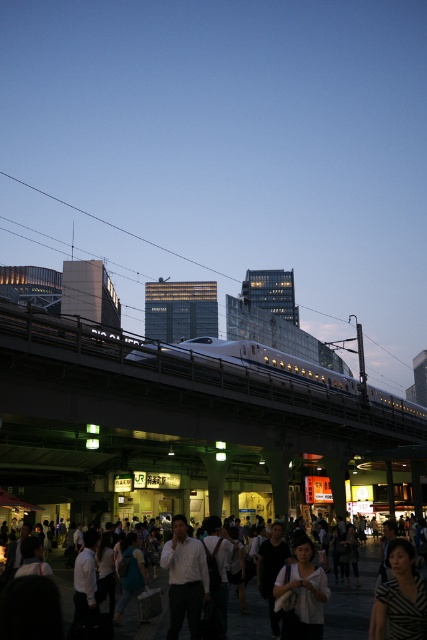
Where is `striped fabric shirt at lower right`? striped fabric shirt at lower right is located at coordinates (400, 596).

Who is more distant from viewer, (412, 579) or (312, 620)?

Positioned behind is point (312, 620).

The height and width of the screenshot is (640, 427). What do you see at coordinates (400, 596) in the screenshot?
I see `striped fabric shirt at lower right` at bounding box center [400, 596].

The image size is (427, 640). Identify the location of striped fabric shirt at lower right. (400, 596).

From the picture: Between striped fabric shirt at lower right and white shirt at center, which one has less height?

With less height is striped fabric shirt at lower right.

Which is more to the right, striped fabric shirt at lower right or white shirt at center?

striped fabric shirt at lower right

Does point (418, 627) come behind point (169, 596)?

No, it is not.

In order to click on striped fabric shirt at lower right in this screenshot , I will do `click(400, 596)`.

Does white matte shirt at lower center come in front of white shirt at center?

Yes, it is in front of white shirt at center.

Is white matte shirt at lower center wider than white shirt at center?

No, white matte shirt at lower center is not wider than white shirt at center.

Who is more forward, (292, 576) or (178, 573)?

Point (292, 576)

Image resolution: width=427 pixels, height=640 pixels. In order to click on white matte shirt at lower center in this screenshot , I will do `click(301, 595)`.